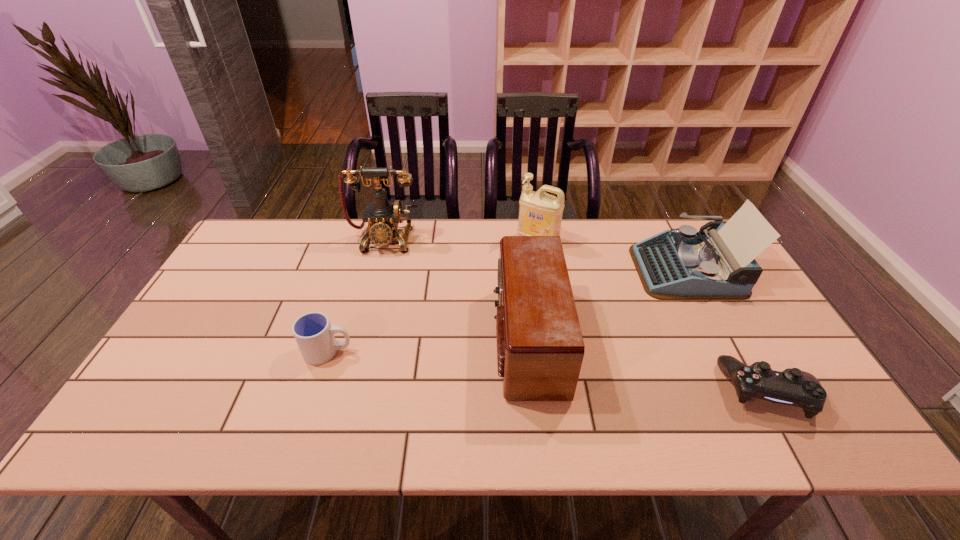
This screenshot has width=960, height=540. In order to click on typewriter at the right edge in this screenshot , I will do `click(717, 263)`.

I want to click on control at the right edge, so click(793, 387).

Find the location of a particular element. object located at the far right corner is located at coordinates (717, 263).

This screenshot has height=540, width=960. Identify the location of object present at the near right corner. (793, 387).

Where is `vacant space at the far edge`? The width and height of the screenshot is (960, 540). vacant space at the far edge is located at coordinates (476, 224).

Locate an element on the screen. The image size is (960, 540). vacant space at the near edge is located at coordinates (538, 429).

Image resolution: width=960 pixels, height=540 pixels. What are the coordinates of `vacant region at the left edge of the desktop` in the screenshot? It's located at (209, 329).

Locate an element on the screen. vacant space at the near left corner is located at coordinates (181, 426).

Where is `vacant area between the detergent and the cup`? The image size is (960, 540). vacant area between the detergent and the cup is located at coordinates click(x=433, y=296).

Image resolution: width=960 pixels, height=540 pixels. Find the location of `unoccupied position between the typewriter and the control`. unoccupied position between the typewriter and the control is located at coordinates (728, 330).